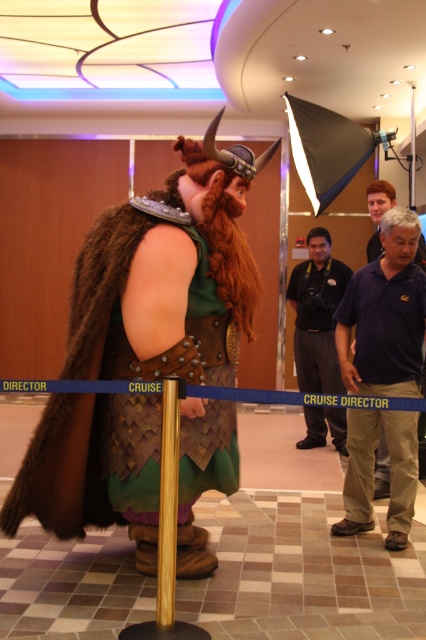
Is point (374, 305) closer to camera compared to point (339, 435)?

Yes, point (374, 305) is closer to viewer.

Describe the element at coordinates (385, 314) in the screenshot. I see `blue cotton polo shirt at center` at that location.

Describe the element at coordinates (385, 314) in the screenshot. I see `blue cotton polo shirt at center` at that location.

Identify the location of blue cotton polo shirt at center. This screenshot has height=640, width=426. (385, 314).

Which is above, fur-like cape at center or dark gray uniform at center?

Positioned higher is dark gray uniform at center.

Which is behind, point (198, 305) or point (328, 388)?

Point (328, 388)

Is point (98, 340) positioned behind point (310, 282)?

No, it is in front of (310, 282).

This screenshot has width=426, height=640. What are the coordinates of `fur-like cape at center` in the screenshot? It's located at (158, 291).

Looking at this image, does fur-like cape at center have a greater width compared to blue cotton polo shirt at center?

Correct, the width of fur-like cape at center exceeds that of blue cotton polo shirt at center.

Which is more to the right, fur-like cape at center or blue cotton polo shirt at center?

From the viewer's perspective, blue cotton polo shirt at center appears more on the right side.

Does point (189, 292) come closer to viewer compared to point (350, 465)?

Yes, point (189, 292) is closer to viewer.

Find the location of a particular element. fur-like cape at center is located at coordinates (158, 291).